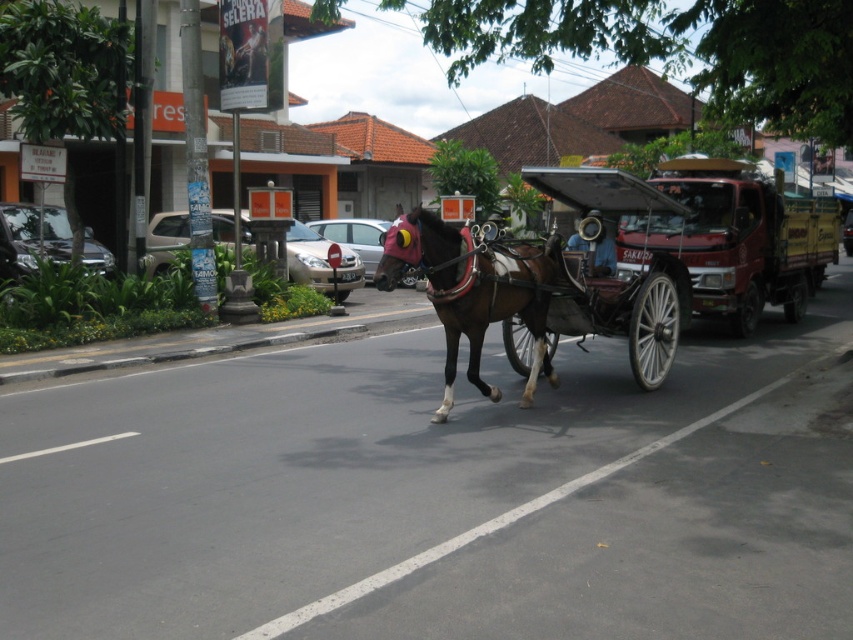
Who is positioned more to the right, metallic red horse cart at center or wooden cart at center?

metallic red horse cart at center is more to the right.

This screenshot has width=853, height=640. Describe the element at coordinates (737, 237) in the screenshot. I see `metallic red horse cart at center` at that location.

Locate an element on the screen. This screenshot has width=853, height=640. metallic red horse cart at center is located at coordinates (737, 237).

Does wooden cart at center have a lesser height compared to brown glossy horse at center?

Indeed, wooden cart at center has a lesser height compared to brown glossy horse at center.

Where is `wooden cart at center`? wooden cart at center is located at coordinates click(x=616, y=269).

Is point (567, 177) positioned before point (427, 244)?

No, it is behind (427, 244).

Find the location of a particular element. This screenshot has width=853, height=640. wooden cart at center is located at coordinates (616, 269).

Does metallic red horse cart at center appear on the right side of brown glossy horse at center?

Correct, you'll find metallic red horse cart at center to the right of brown glossy horse at center.

Can you confirm if metallic red horse cart at center is smaller than brown glossy horse at center?

Yes.

Identify the location of metallic red horse cart at center. This screenshot has width=853, height=640. (737, 237).

This screenshot has height=640, width=853. Identify the location of metallic red horse cart at center. (737, 237).